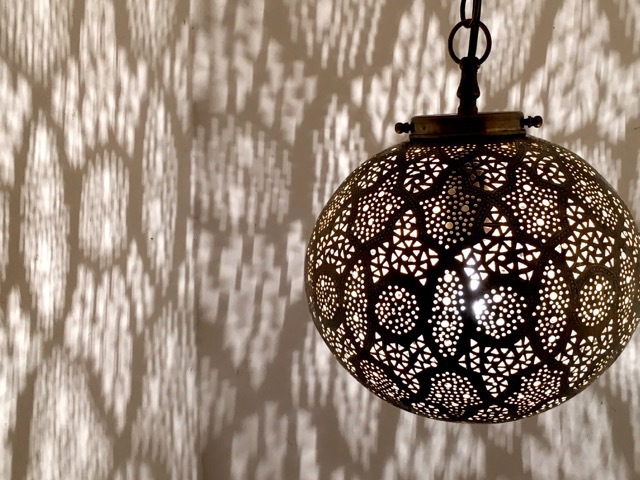
Image resolution: width=640 pixels, height=480 pixels. I want to click on walls, so click(x=250, y=328), click(x=102, y=345).